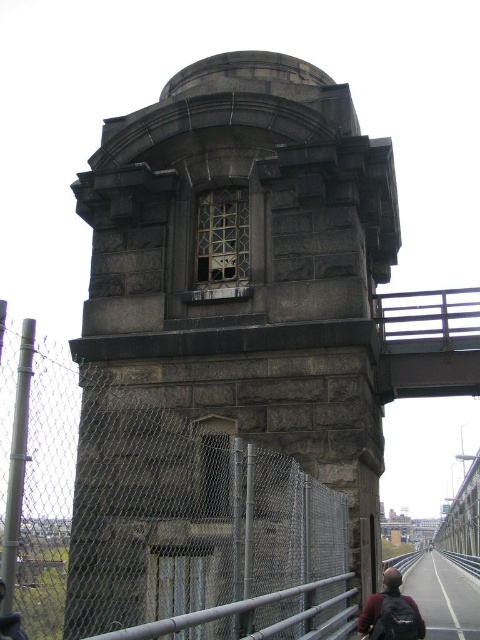
From the picture: You are standing in front of the stone structure and want to place two markers at point (307, 131) and point (376, 611). According to the scene, which marker will be closer to the chain link fence?

Point (376, 611) is closer to the chain link fence because it is in front of point (307, 131), which is behind it.

You are standing near the gray stone tower at center and the dark brown backpack at lower right. Which object is higher up in the scene?

The gray stone tower at center is located above the dark brown backpack at lower right, so it is higher up in the scene.